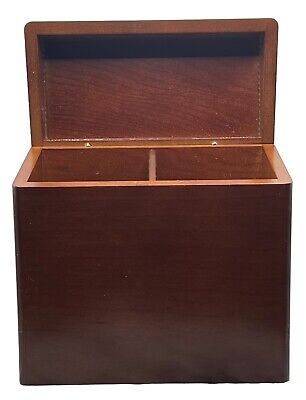
Where is `lid of box`? The image size is (306, 400). lid of box is located at coordinates (152, 25).